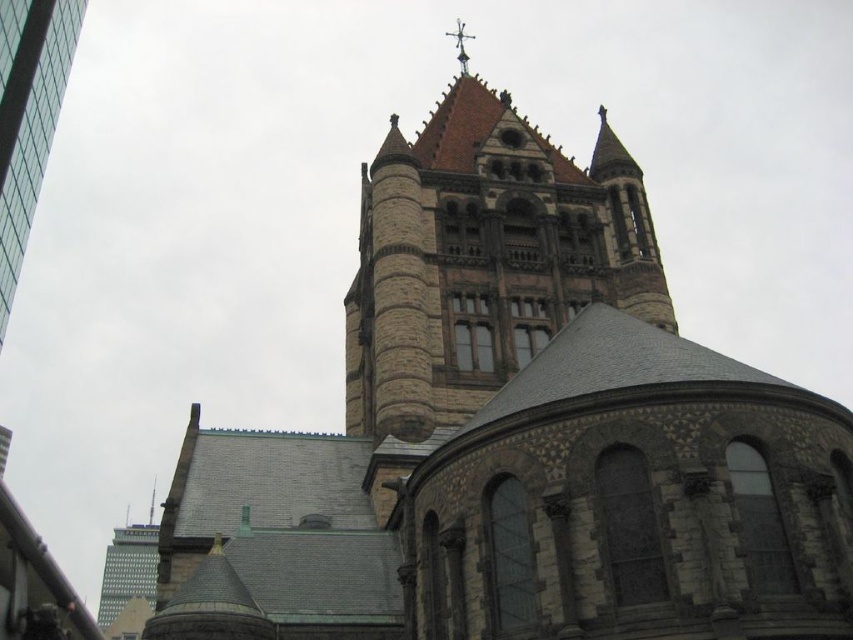
Identify the location of brown stone tower at upper center. (483, 257).

Between brown stone tower at upper center and glassy steel skyscraper at upper left, which one has more height?

Standing taller between the two is brown stone tower at upper center.

Image resolution: width=853 pixels, height=640 pixels. Identify the location of brown stone tower at upper center. (483, 257).

Does glassy steel skyscraper at upper left have a larger size compared to gray concrete skyscraper at lower left?

No.

Describe the element at coordinates (28, 116) in the screenshot. This screenshot has width=853, height=640. I see `glassy steel skyscraper at upper left` at that location.

Does point (32, 92) lie in front of point (154, 536)?

Yes, it is.

I want to click on glassy steel skyscraper at upper left, so click(28, 116).

Is point (537, 305) farther from viewer compared to point (136, 524)?

That is False.

Image resolution: width=853 pixels, height=640 pixels. What are the coordinates of `brown stone tower at upper center` in the screenshot? It's located at click(483, 257).